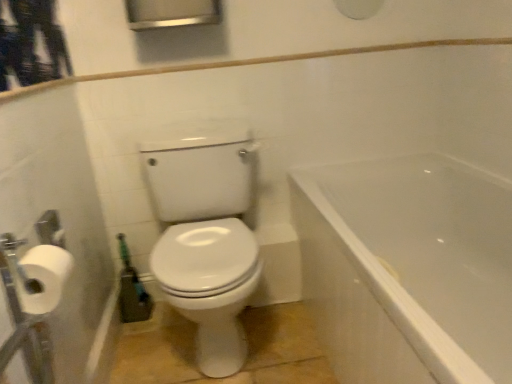
What do you see at coordinates (45, 277) in the screenshot? This screenshot has height=384, width=512. I see `white matte toilet paper at left` at bounding box center [45, 277].

Find the location of a particular element. This screenshot has height=384, width=512. white matte toilet paper at left is located at coordinates (45, 277).

What do you see at coordinates (408, 269) in the screenshot? I see `white glossy bathtub at right` at bounding box center [408, 269].

Measure the distance between point [448,371] and camera.

Point [448,371] and camera are 27.13 inches apart.

Where is `white glossy bathtub at right`? The width and height of the screenshot is (512, 384). white glossy bathtub at right is located at coordinates (408, 269).

Measure the distance between white glossy bathtub at right and camera.

white glossy bathtub at right is 26.11 inches away from camera.

Where is `white matte toilet paper at left`? This screenshot has width=512, height=384. white matte toilet paper at left is located at coordinates (45, 277).

Which object is positioned more to the right, white glossy bathtub at right or white matte toilet paper at left?

Positioned to the right is white glossy bathtub at right.

Which object is closer to the camera, white glossy bathtub at right or white matte toilet paper at left?

Positioned in front is white glossy bathtub at right.

Which is less distant, (490, 282) or (49, 267)?

The point (49, 267) is more forward.

From the image's perspective, is white glossy bathtub at right over white matte toilet paper at left?

No, from the image's perspective, white glossy bathtub at right is not on top of white matte toilet paper at left.

From a real-world perspective, is white glossy bathtub at right positioned above or below white matte toilet paper at left?

white glossy bathtub at right is below white matte toilet paper at left.

Between white glossy bathtub at right and white matte toilet paper at left, which one has smaller width?

white matte toilet paper at left.

From their relative heights in the image, would you say white glossy bathtub at right is taller or shorter than white matte toilet paper at left?

In the image, white glossy bathtub at right appears to be taller than white matte toilet paper at left.

Considering the relative sizes of white glossy bathtub at right and white matte toilet paper at left in the image provided, is white glossy bathtub at right smaller than white matte toilet paper at left?

Actually, white glossy bathtub at right might be larger than white matte toilet paper at left.

Based on the photo, which is correct: white glossy bathtub at right is inside white matte toilet paper at left, or outside of it?

white glossy bathtub at right is not enclosed by white matte toilet paper at left.

Looking at this image, is white glossy bathtub at right touching white matte toilet paper at left?

There is a gap between white glossy bathtub at right and white matte toilet paper at left.

From the picture: Is white glossy bathtub at right looking in the opposite direction of white matte toilet paper at left?

white glossy bathtub at right does not have its back to white matte toilet paper at left.

What's the angular difference between white glossy bathtub at right and white matte toilet paper at left's facing directions?

There is a 180-degree angle between the facing directions of white glossy bathtub at right and white matte toilet paper at left.

How distant is white glossy bathtub at right from white matte toilet paper at left?

A distance of 1.02 meters exists between white glossy bathtub at right and white matte toilet paper at left.

The image size is (512, 384). What are the coordinates of `bathtub to the right of white matte toilet paper at left` in the screenshot? It's located at (408, 269).

Which object is positioned more to the left, white matte toilet paper at left or white glossy bathtub at right?

From the viewer's perspective, white matte toilet paper at left appears more on the left side.

Considering their positions, is white matte toilet paper at left located in front of or behind white glossy bathtub at right?

white matte toilet paper at left is positioned farther from the viewer than white glossy bathtub at right.

Is point (32, 305) behind point (424, 206)?

No, it is in front of (424, 206).

From the image's perspective, which is above, white matte toilet paper at left or white glossy bathtub at right?

From the image's view, white matte toilet paper at left is above.

From a real-world perspective, which object rests below the other?

white glossy bathtub at right is physically lower.

Considering the sizes of white matte toilet paper at left and white glossy bathtub at right in the image, is white matte toilet paper at left wider or thinner than white glossy bathtub at right?

Clearly, white matte toilet paper at left has less width compared to white glossy bathtub at right.

Does white matte toilet paper at left have a lesser height compared to white glossy bathtub at right?

Yes.

Between white matte toilet paper at left and white glossy bathtub at right, which one has smaller size?

Smaller between the two is white matte toilet paper at left.

Is white glossy bathtub at right surrounded by white matte toilet paper at left?

No, white glossy bathtub at right is not surrounded by white matte toilet paper at left.

Are white matte toilet paper at left and white glossy bathtub at right located far from each other?

white matte toilet paper at left is far away from white glossy bathtub at right.

Is white glossy bathtub at right at the back of white matte toilet paper at left?

No, white matte toilet paper at left is not facing away from white glossy bathtub at right.

Based on the photo, can you tell me how much white matte toilet paper at left and white glossy bathtub at right differ in facing direction?

180 degrees separate the facing orientations of white matte toilet paper at left and white glossy bathtub at right.

The image size is (512, 384). I want to click on toilet paper located on the left of white glossy bathtub at right, so click(45, 277).

Where is `toilet paper above the white glossy bathtub at right (from the image's perspective)`? The width and height of the screenshot is (512, 384). toilet paper above the white glossy bathtub at right (from the image's perspective) is located at coordinates (45, 277).

In order to click on toilet paper behind the white glossy bathtub at right in this screenshot , I will do `click(45, 277)`.